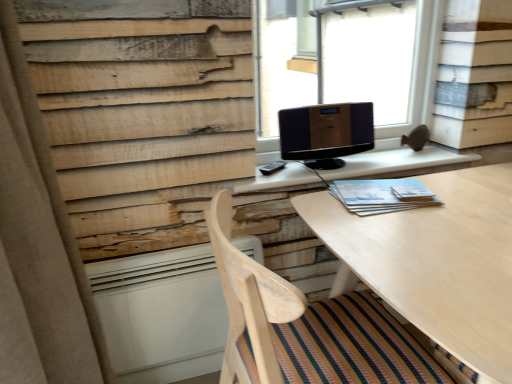
Question: Is beige fabric curtain at left closer to the viewer compared to wooden chair at lower center?

Choices:
 (A) yes
 (B) no

Answer: (A)

Question: Can you confirm if beige fabric curtain at left is bigger than wooden chair at lower center?

Choices:
 (A) yes
 (B) no

Answer: (B)

Question: Is beige fabric curtain at left wider than wooden chair at lower center?

Choices:
 (A) no
 (B) yes

Answer: (A)

Question: Are beige fabric curtain at left and wooden chair at lower center far apart?

Choices:
 (A) yes
 (B) no

Answer: (B)

Question: Does beige fabric curtain at left contain wooden chair at lower center?

Choices:
 (A) yes
 (B) no

Answer: (B)

Question: Based on their sizes in the image, would you say wooden chair at lower center is bigger or smaller than white matte radiator at lower left?

Choices:
 (A) small
 (B) big

Answer: (B)

Question: Based on their positions, is wooden chair at lower center located to the left or right of white matte radiator at lower left?

Choices:
 (A) left
 (B) right

Answer: (B)

Question: Is wooden chair at lower center taller or shorter than white matte radiator at lower left?

Choices:
 (A) tall
 (B) short

Answer: (A)

Question: From the image's perspective, is wooden chair at lower center located above or below white matte radiator at lower left?

Choices:
 (A) below
 (B) above

Answer: (A)

Question: In terms of size, does transparent glass speaker at upper center appear bigger or smaller than shiny black monitor at center?

Choices:
 (A) big
 (B) small

Answer: (A)

Question: From a real-world perspective, is transparent glass speaker at upper center positioned above or below shiny black monitor at center?

Choices:
 (A) below
 (B) above

Answer: (B)

Question: Relative to shiny black monitor at center, is transparent glass speaker at upper center in front or behind?

Choices:
 (A) behind
 (B) front

Answer: (A)

Question: From the image's perspective, is transparent glass speaker at upper center located above or below shiny black monitor at center?

Choices:
 (A) below
 (B) above

Answer: (B)

Question: From their relative heights in the image, would you say beige fabric curtain at left is taller or shorter than transparent glass speaker at upper center?

Choices:
 (A) tall
 (B) short

Answer: (A)

Question: Which is correct: beige fabric curtain at left is inside transparent glass speaker at upper center, or outside of it?

Choices:
 (A) inside
 (B) outside

Answer: (B)